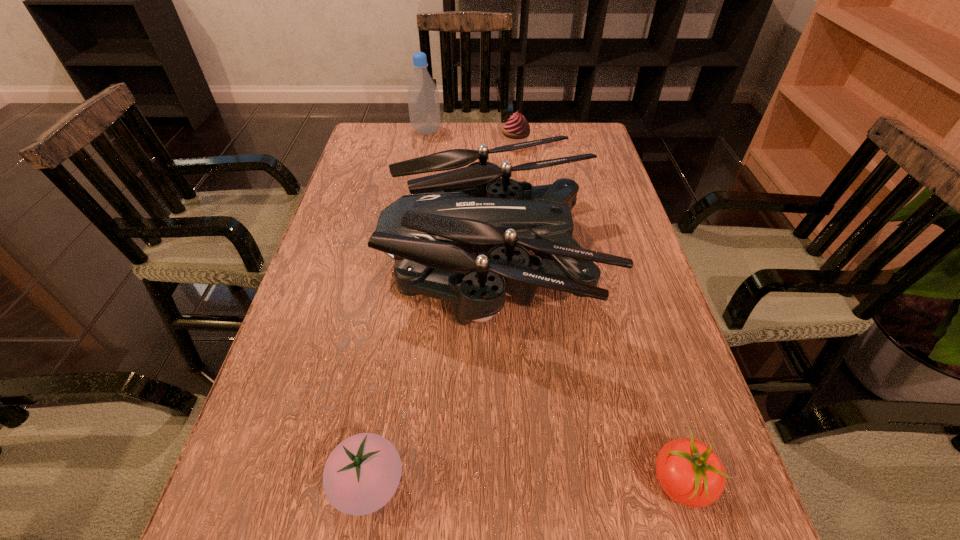
At what (x,y) coordinates should I click in order to perform the action: click on vacant space at the left edge of the desktop. Please return your answer as a coordinate pair (x, y). The width and height of the screenshot is (960, 540). Looking at the image, I should click on (369, 191).

This screenshot has height=540, width=960. In order to click on free space at the right edge of the desktop in this screenshot , I will do click(x=614, y=198).

This screenshot has height=540, width=960. Find the location of `vacant space at the far left corner`. vacant space at the far left corner is located at coordinates (366, 142).

In the image, there is a desktop. Where is `vacant region at the far right corner`? The width and height of the screenshot is (960, 540). vacant region at the far right corner is located at coordinates (591, 153).

This screenshot has width=960, height=540. I want to click on vacant region between the left tomato and the cupcake, so click(x=442, y=315).

This screenshot has height=540, width=960. I want to click on unoccupied position between the drone and the left tomato, so click(x=430, y=372).

In order to click on free space between the left tomato and the drone in this screenshot , I will do `click(430, 372)`.

Image resolution: width=960 pixels, height=540 pixels. I want to click on free spot between the left tomato and the bottle, so click(x=397, y=308).

This screenshot has height=540, width=960. I want to click on vacant region between the right tomato and the bottle, so click(553, 307).

Identify the location of vacant space that's between the third nearest object and the left tomato. (430, 372).